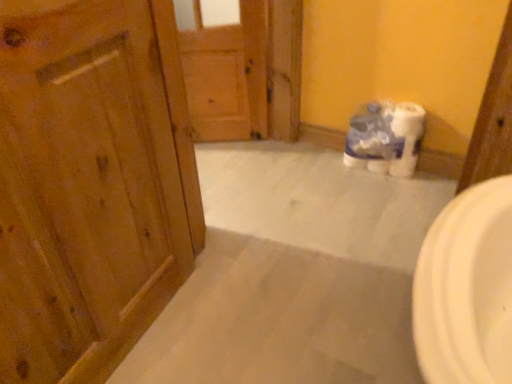
Question: Is white plastic toilet paper at center facing away from wooden door at left, which is counted as the 2th door, starting from the back?

Choices:
 (A) no
 (B) yes

Answer: (A)

Question: Considering the relative sizes of white plastic toilet paper at center and wooden door at left, which is counted as the 2th door, starting from the back, in the image provided, is white plastic toilet paper at center shorter than wooden door at left, which is counted as the 2th door, starting from the back,?

Choices:
 (A) yes
 (B) no

Answer: (A)

Question: From the image's perspective, would you say white plastic toilet paper at center is positioned over wooden door at left, the 1th door positioned from the front?

Choices:
 (A) no
 (B) yes

Answer: (B)

Question: Does white plastic toilet paper at center touch wooden door at left, which is counted as the 2th door, starting from the back?

Choices:
 (A) no
 (B) yes

Answer: (A)

Question: From a real-world perspective, is white plastic toilet paper at center located beneath wooden door at left, which is counted as the 2th door, starting from the back?

Choices:
 (A) no
 (B) yes

Answer: (B)

Question: Is the position of white plastic toilet paper at center more distant than that of wooden door at left, which is counted as the 2th door, starting from the back?

Choices:
 (A) yes
 (B) no

Answer: (A)

Question: Can you confirm if wooden door at left, the 1th door positioned from the front, is taller than white plastic toilet paper at center?

Choices:
 (A) yes
 (B) no

Answer: (A)

Question: Could you tell me if wooden door at left, which is counted as the 2th door, starting from the back, is turned towards white plastic toilet paper at center?

Choices:
 (A) no
 (B) yes

Answer: (A)

Question: From a real-world perspective, does wooden door at left, which is counted as the 2th door, starting from the back, sit lower than white plastic toilet paper at center?

Choices:
 (A) no
 (B) yes

Answer: (A)

Question: Is wooden door at left, which is counted as the 2th door, starting from the back, wider than white plastic toilet paper at center?

Choices:
 (A) yes
 (B) no

Answer: (B)

Question: From a real-world perspective, does wooden door at left, the 1th door positioned from the front, stand above white plastic toilet paper at center?

Choices:
 (A) no
 (B) yes

Answer: (B)

Question: Is wooden door at left, the 1th door positioned from the front, positioned with its back to white plastic toilet paper at center?

Choices:
 (A) no
 (B) yes

Answer: (A)

Question: From a real-world perspective, is white plastic toilet paper at center below wooden door at center, the 2th door viewed from the front?

Choices:
 (A) no
 (B) yes

Answer: (B)